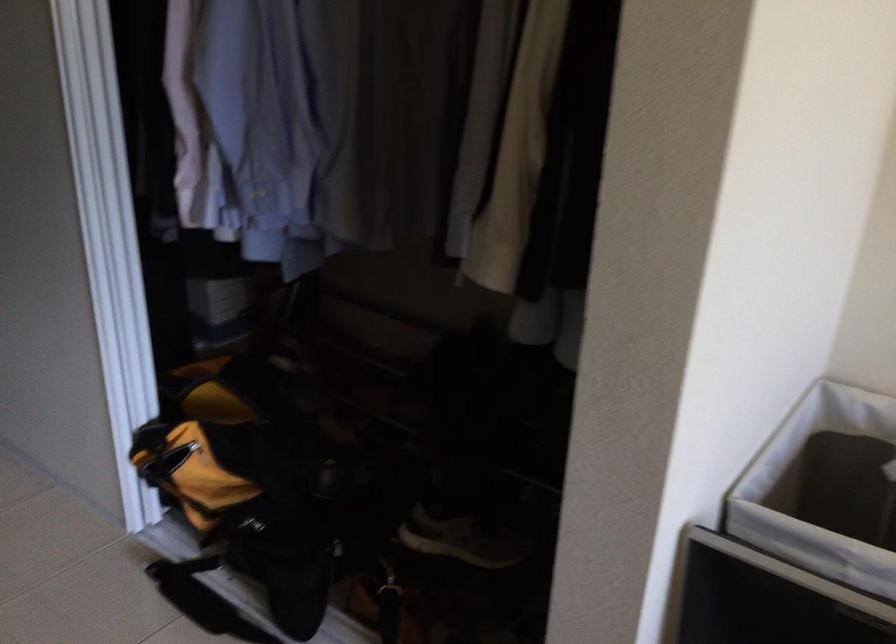
Where would you pull the bag zipper pull? Please return your answer as a coordinate pair (x, y).

(253, 525)